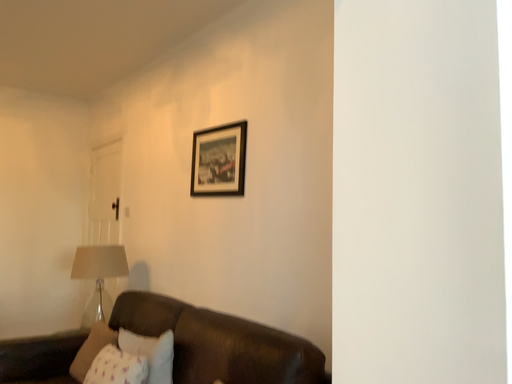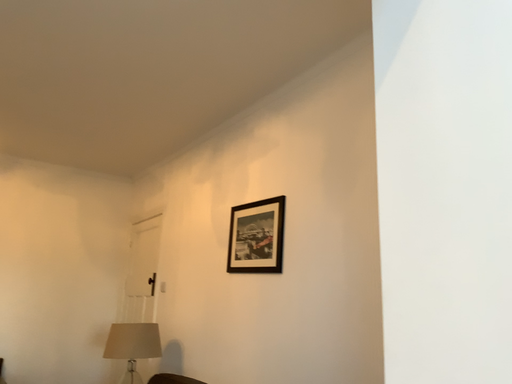
Question: Which way did the camera rotate in the video?

Choices:
 (A) rotated downward
 (B) rotated upward

Answer: (B)